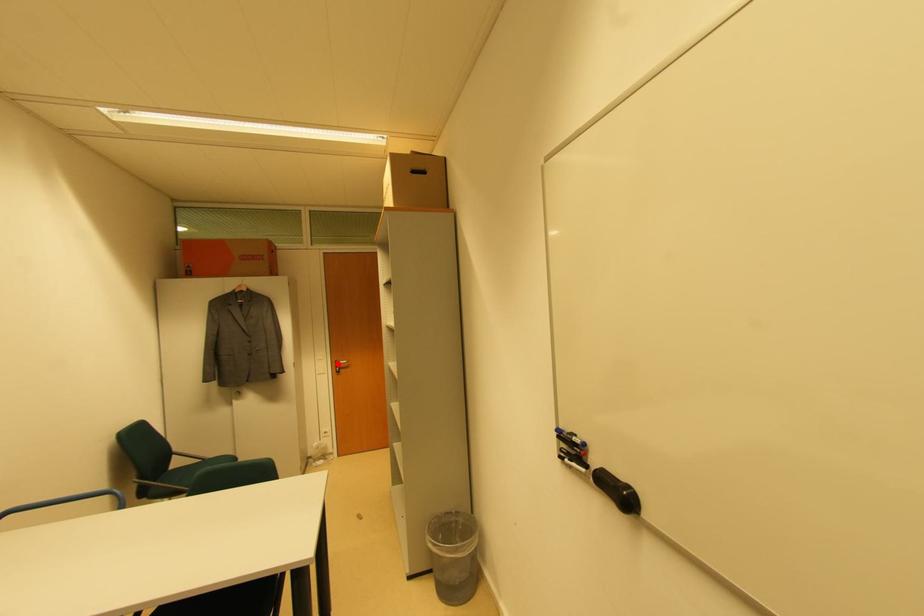
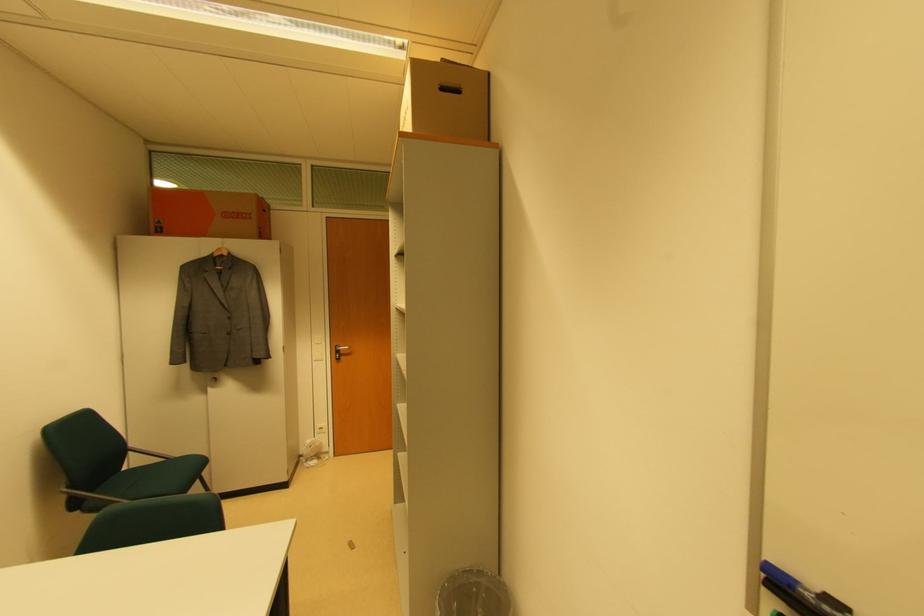
The point at the highlighted location is marked in the first image. Where is the corresponding point in the second image?

(337, 349)